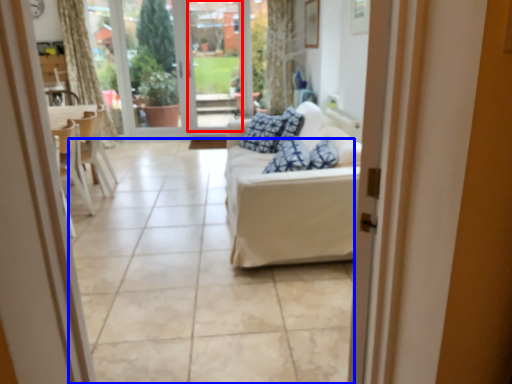
Question: Which object appears farthest to the camera in this image, window screen (highlighted by a red box) or tile (highlighted by a blue box)?

Choices:
 (A) window screen
 (B) tile

Answer: (A)